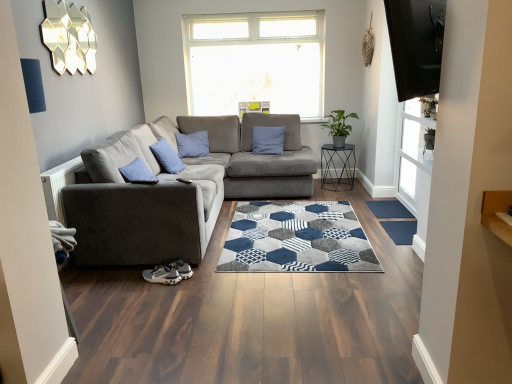
Question: Is suede gray couch at left at the left side of dark blue textured mat at lower right?

Choices:
 (A) yes
 (B) no

Answer: (A)

Question: Is suede gray couch at left in contact with dark blue textured mat at lower right?

Choices:
 (A) yes
 (B) no

Answer: (B)

Question: Can you confirm if suede gray couch at left is wider than dark blue textured mat at lower right?

Choices:
 (A) yes
 (B) no

Answer: (A)

Question: Does suede gray couch at left appear on the right side of dark blue textured mat at lower right?

Choices:
 (A) yes
 (B) no

Answer: (B)

Question: Is suede gray couch at left bigger than dark blue textured mat at lower right?

Choices:
 (A) yes
 (B) no

Answer: (A)

Question: Can you confirm if suede gray couch at left is thinner than dark blue textured mat at lower right?

Choices:
 (A) no
 (B) yes

Answer: (A)

Question: Considering the relative positions of blue textured mat at lower right and dark blue textured mat at lower right in the image provided, is blue textured mat at lower right to the left of dark blue textured mat at lower right from the viewer's perspective?

Choices:
 (A) no
 (B) yes

Answer: (A)

Question: Is blue textured mat at lower right in contact with dark blue textured mat at lower right?

Choices:
 (A) no
 (B) yes

Answer: (A)

Question: Is blue textured mat at lower right surrounding dark blue textured mat at lower right?

Choices:
 (A) yes
 (B) no

Answer: (B)

Question: Are blue textured mat at lower right and dark blue textured mat at lower right far apart?

Choices:
 (A) no
 (B) yes

Answer: (A)

Question: Can you confirm if blue textured mat at lower right is bigger than dark blue textured mat at lower right?

Choices:
 (A) no
 (B) yes

Answer: (A)

Question: Is blue textured mat at lower right located outside dark blue textured mat at lower right?

Choices:
 (A) yes
 (B) no

Answer: (A)

Question: Is blue textured mat at lower right touching blue cotton pillow at center?

Choices:
 (A) no
 (B) yes

Answer: (A)